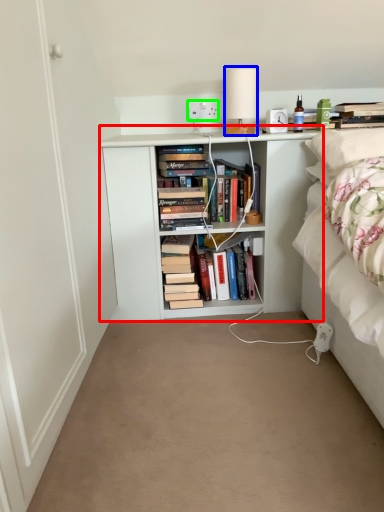
Question: Which object is positioned farthest from shelf (highlighted by a red box)? Select from table lamp (highlighted by a blue box) and electric outlet (highlighted by a green box).

Choices:
 (A) table lamp
 (B) electric outlet

Answer: (B)